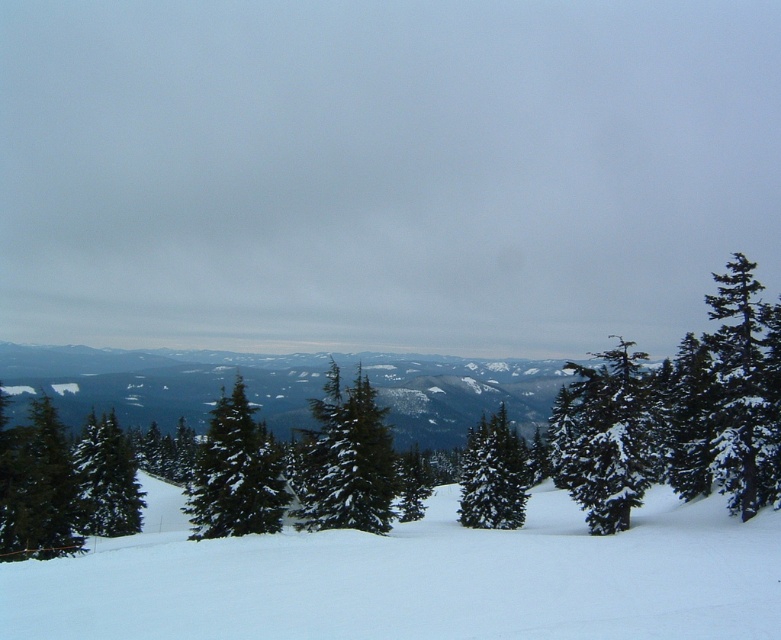
Image resolution: width=781 pixels, height=640 pixels. Describe the element at coordinates (105, 480) in the screenshot. I see `green matte evergreen at left` at that location.

Who is higher up, green matte evergreen at left or green matte tree at center?

green matte evergreen at left is above.

Is point (123, 504) farther from viewer compared to point (487, 465)?

Yes.

This screenshot has width=781, height=640. Identify the location of green matte evergreen at left. (105, 480).

Is green matte tree at lower left thinner than green matte tree at center?

Correct, green matte tree at lower left's width is less than green matte tree at center's.

Locate an element on the screen. green matte tree at lower left is located at coordinates (36, 486).

You are a GUI agent. You are given a task and a screenshot of the screen. Output one action in this format:
    pyautogui.click(x=<x>, y=<y>)
    Task: Click on the green matte tree at lower left
    
    Given the screenshot: What is the action you would take?
    pyautogui.click(x=36, y=486)

Between snow-covered evergreen tree at center and green matte tree at center, which one is positioned lower?

Positioned lower is green matte tree at center.

Is point (332, 360) positioned in front of point (462, 467)?

No, (332, 360) is behind (462, 467).

At what (x,y) coordinates should I click in order to perform the action: click on snow-covered evergreen tree at center. Please return your answer as a coordinate pair (x, y). Looking at the image, I should click on (348, 460).